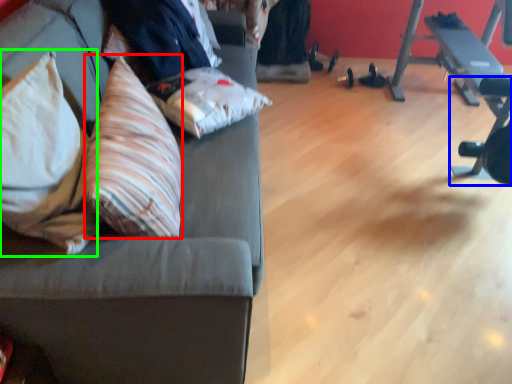
Question: Which is nearer to the throw pillow (highlighted by a red box)? barbell (highlighted by a blue box) or throw pillow (highlighted by a green box).

Choices:
 (A) barbell
 (B) throw pillow

Answer: (B)